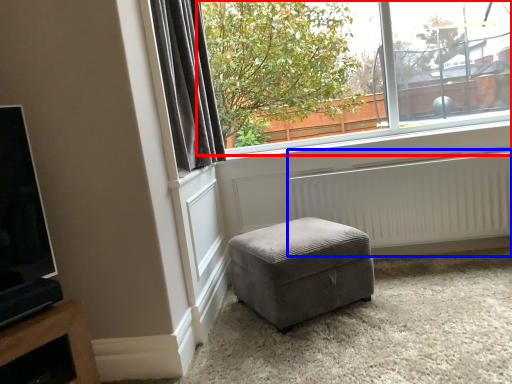
Question: Which of the following is the closest to the observer, window (highlighted by a red box) or radiator (highlighted by a blue box)?

Choices:
 (A) window
 (B) radiator

Answer: (B)